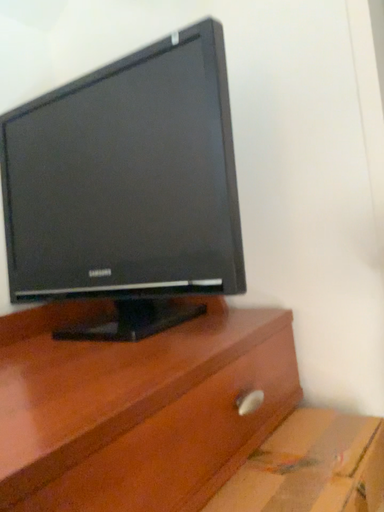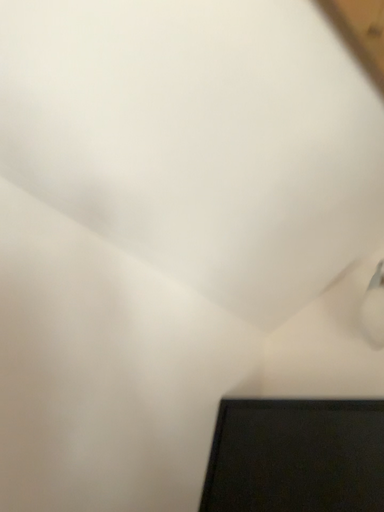
Question: How did the camera likely rotate when shooting the video?

Choices:
 (A) rotated upward
 (B) rotated downward

Answer: (A)